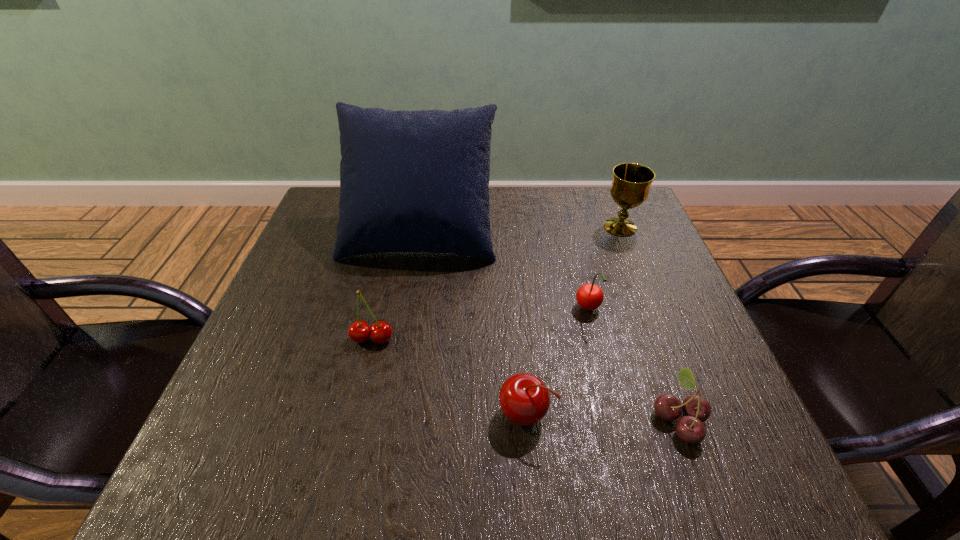
This screenshot has width=960, height=540. Identify the location of free space between the tallest object and the chalice. (520, 229).

This screenshot has width=960, height=540. What are the coordinates of `object that is the fourth nearest to the third cherry from right to left` in the screenshot? It's located at (x=410, y=181).

This screenshot has width=960, height=540. Identify the location of object that is the closest to the third cherry from right to left. (696, 409).

This screenshot has width=960, height=540. In order to click on cherry that is the fourth closest to the tallest object in this screenshot , I will do `click(696, 409)`.

This screenshot has height=540, width=960. What are the coordinates of `cherry identified as the third closest to the shortest cherry` in the screenshot? It's located at (381, 332).

What are the coordinates of `blank space that satisfies the following two spatial constraints: 1. on the back side of the second cherry from left to right; 2. on the left side of the chalice` in the screenshot? It's located at (510, 227).

This screenshot has width=960, height=540. I want to click on blank area in the image that satisfies the following two spatial constraints: 1. with the stems of the third nearest object pointing upwards; 2. on the left side of the third cherry from right to left, so click(354, 414).

The width and height of the screenshot is (960, 540). I want to click on vacant area in the image that satisfies the following two spatial constraints: 1. on the front side of the chalice; 2. on the leaves of the rightmost cherry, so click(x=698, y=418).